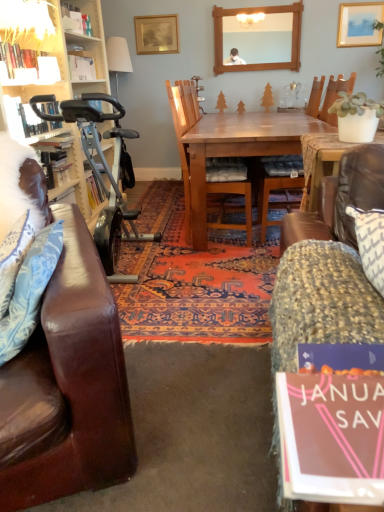
I want to click on free space above wooden frame mirror at upper center (from a real-world perspective), so click(250, 1).